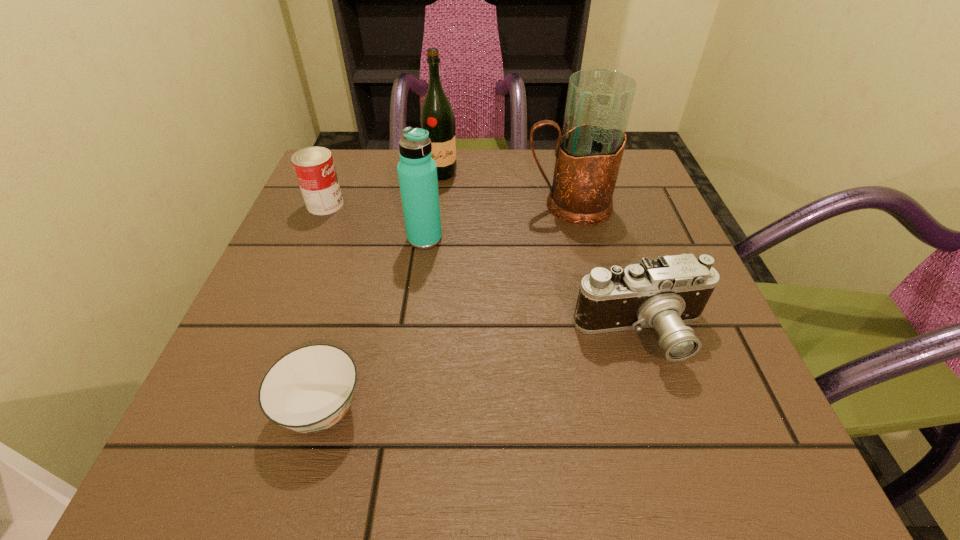
Locate an element on the screen. vacant area between the leftmost object and the camera is located at coordinates (484, 269).

Identify the location of object that is the third closest to the can. (308, 390).

Identify which object is the nearest to the camera. Please provide its 2D coordinates. Your answer should be formatted as a tuple, i.e. [(x, y)], where the tuple contains the x and y coordinates of a point satisfying the conditions above.

[(589, 151)]

At what (x,y) coordinates should I click in order to perform the action: click on free location that satisfies the following two spatial constraints: 1. on the front label of the leftmost object; 2. on the back side of the shortest object. Please return your answer as a coordinate pair (x, y). Looking at the image, I should click on (240, 409).

You are a GUI agent. You are given a task and a screenshot of the screen. Output one action in this format:
    pyautogui.click(x=<x>, y=<y>)
    Task: Click on the vacant area that satisfies the following two spatial constraints: 1. on the front label of the leftmost object; 2. on the left side of the water bottle
    This screenshot has height=540, width=960.
    Given the screenshot: What is the action you would take?
    pyautogui.click(x=311, y=239)